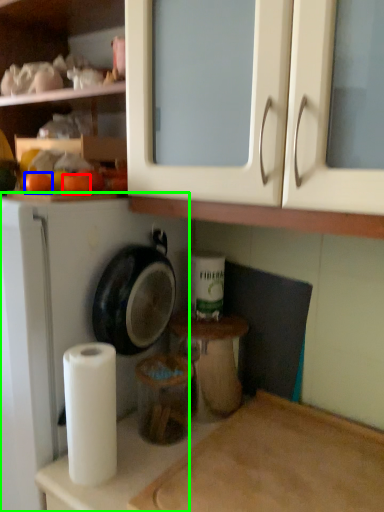
Question: Considering the real-world distances, which object is closest to orange (highlighted by a red box)? orange (highlighted by a blue box) or dish washer (highlighted by a green box).

Choices:
 (A) orange
 (B) dish washer

Answer: (A)